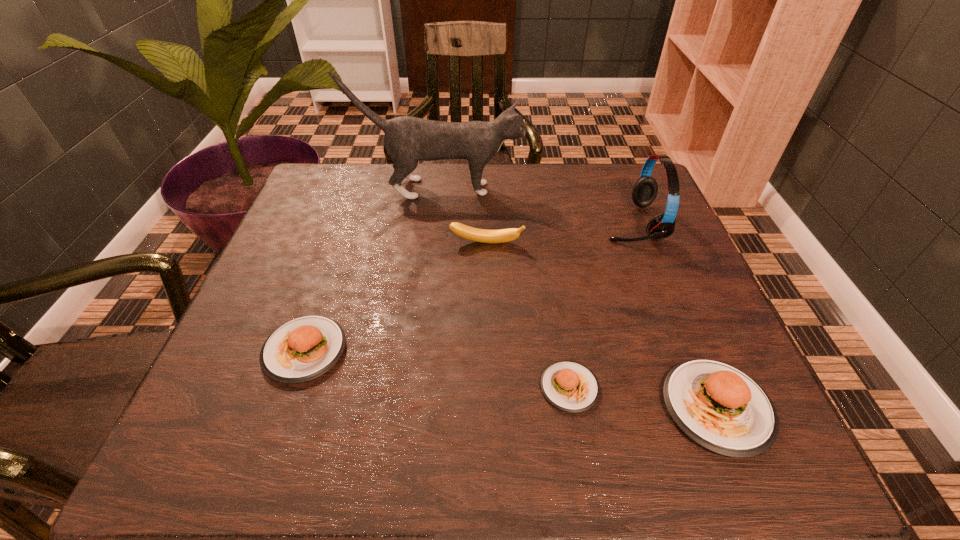
Find the location of a particular element. food at the right edge is located at coordinates (721, 408).

Identify the location of headset at the right edge. (644, 192).

Locate an element on the screen. object that is at the far left corner is located at coordinates (407, 140).

Where is `object present at the near left corner`? Image resolution: width=960 pixels, height=540 pixels. object present at the near left corner is located at coordinates (302, 349).

This screenshot has width=960, height=540. In order to click on object present at the far right corner in this screenshot , I will do `click(644, 192)`.

Identify the location of object present at the near right corner. The height and width of the screenshot is (540, 960). (721, 408).

Find the location of a particular element. free space at the far edge is located at coordinates (547, 202).

Locate an element on the screen. This screenshot has height=540, width=960. vacant space at the near edge of the desktop is located at coordinates (620, 366).

Locate an element on the screen. vacant space at the left edge of the desktop is located at coordinates (304, 221).

In the image, there is a desktop. Identify the location of free space at the right edge. Image resolution: width=960 pixels, height=540 pixels. (623, 271).